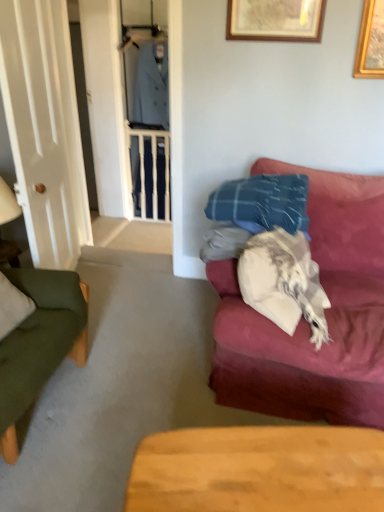
Where is `blank space situated above wooden table at lower center (from a real-world perspective)`? blank space situated above wooden table at lower center (from a real-world perspective) is located at coordinates (276, 460).